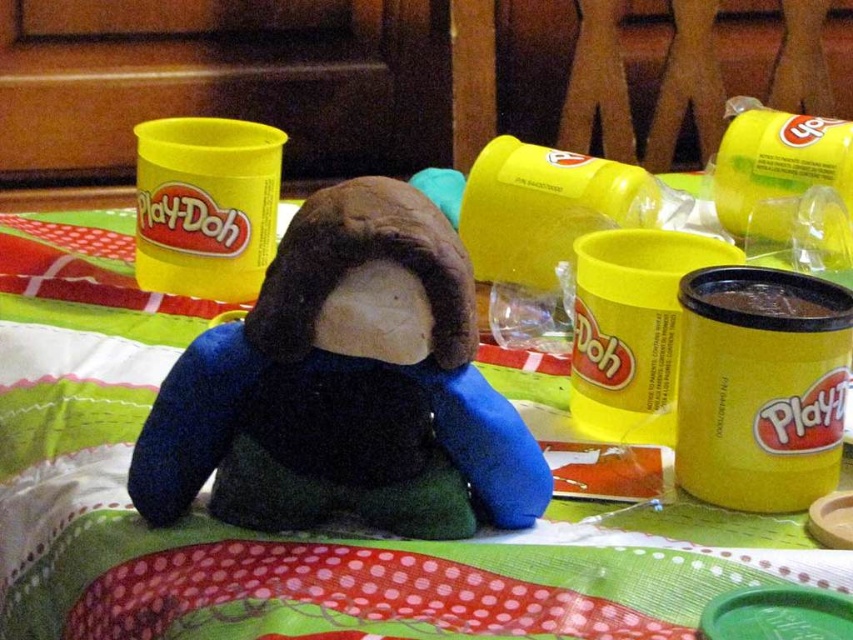
Is velvety brown plush at center to the left of yellow matte play-doh at center right from the viewer's perspective?

Correct, you'll find velvety brown plush at center to the left of yellow matte play-doh at center right.

Where is `velvety brown plush at center`? Image resolution: width=853 pixels, height=640 pixels. velvety brown plush at center is located at coordinates (345, 388).

Between point (497, 589) and point (514, 445), which one is positioned in front?

Point (497, 589) is more forward.

Which of these two, polka dot fabric at center or velvety brown plush at center, stands taller?

Standing taller between the two is polka dot fabric at center.

Which is in front, point (71, 636) or point (405, 401)?

Positioned in front is point (405, 401).

This screenshot has width=853, height=640. I want to click on polka dot fabric at center, so click(314, 534).

Does polka dot fabric at center appear under yellow matte play-doh at center right?

Correct, polka dot fabric at center is located below yellow matte play-doh at center right.

Between polka dot fabric at center and yellow matte play-doh at center right, which one has more height?

Standing taller between the two is polka dot fabric at center.

Does point (489, 602) come closer to viewer compared to point (817, 436)?

Yes, point (489, 602) is closer to viewer.

Find the location of `polka dot fabric at center`. polka dot fabric at center is located at coordinates (314, 534).